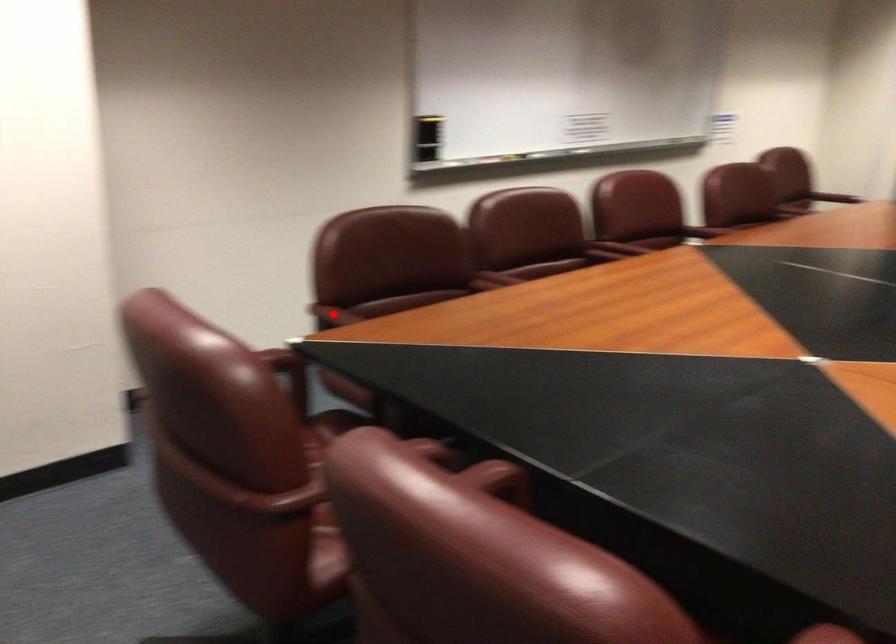
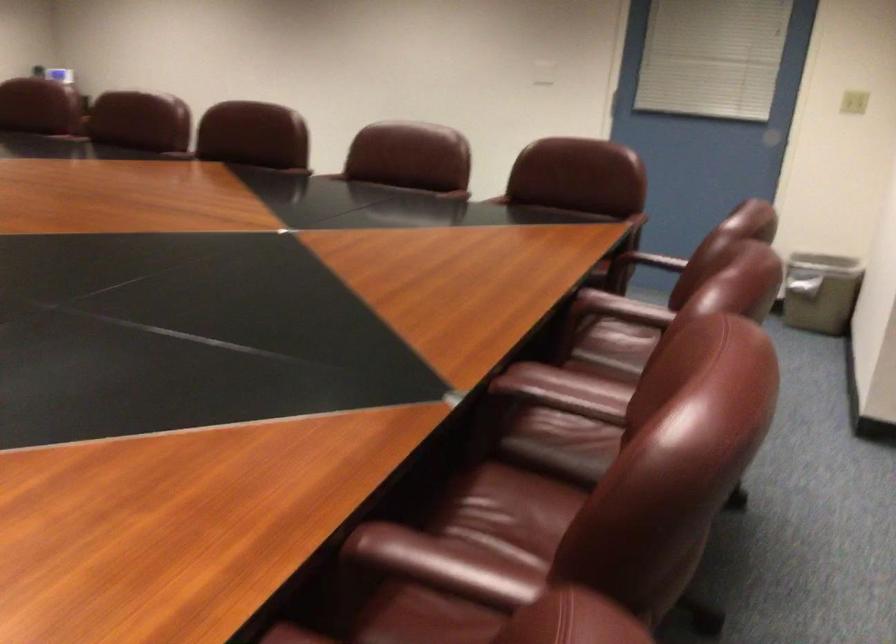
Question: I am providing you with two images of the same scene from different viewpoints. A red point is marked on the first image. Can you still see the location of the red point in image 2?

Choices:
 (A) Yes
 (B) No

Answer: (B)